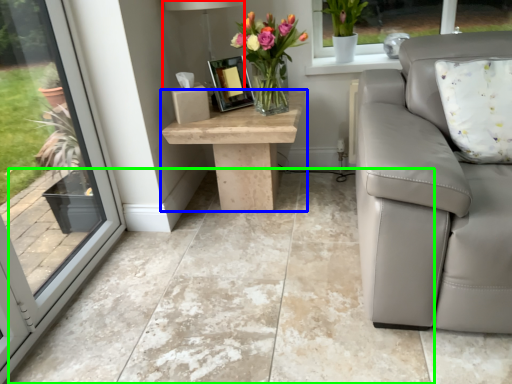
Question: Based on their relative distances, which object is nearer to lamp (highlighted by a red box)? Choose from table (highlighted by a blue box) and concrete (highlighted by a green box).

Choices:
 (A) table
 (B) concrete

Answer: (A)